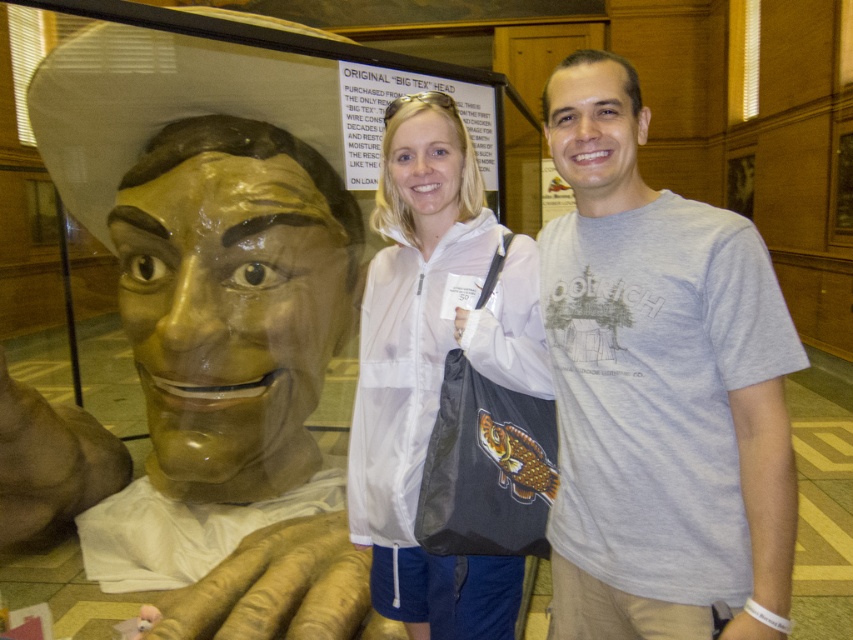
Which is behind, point (730, 280) or point (527, 342)?

Point (527, 342)

Identify the location of gray cotton t-shirt at right. The image size is (853, 640). (659, 387).

The image size is (853, 640). I want to click on gray cotton t-shirt at right, so click(659, 387).